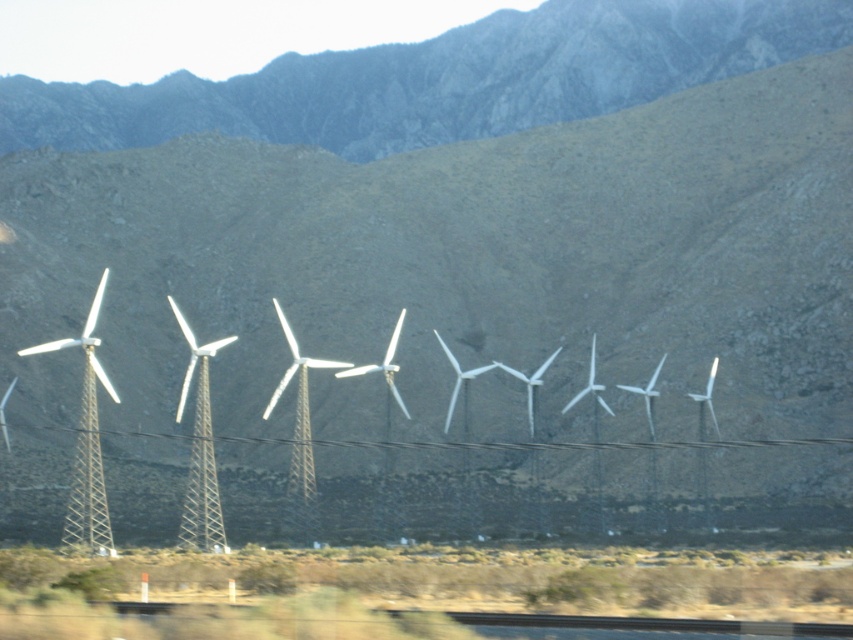
You are a drone operator planning to fly a drone from the white metallic windmill at left to the metallic silver power line at center. Given that the drone can only ascend or descend 1 meter at a time, how many steps will it take to adjust its altitude to match the power line?

The white metallic windmill at left is taller than the metallic silver power line at center. Since the drone can ascend or descend 1 meter per step, it needs to descend the difference in height between the two. However, the exact height difference isn not provided in the object descriptions. Therefore, the question cannot be answered with the given information.